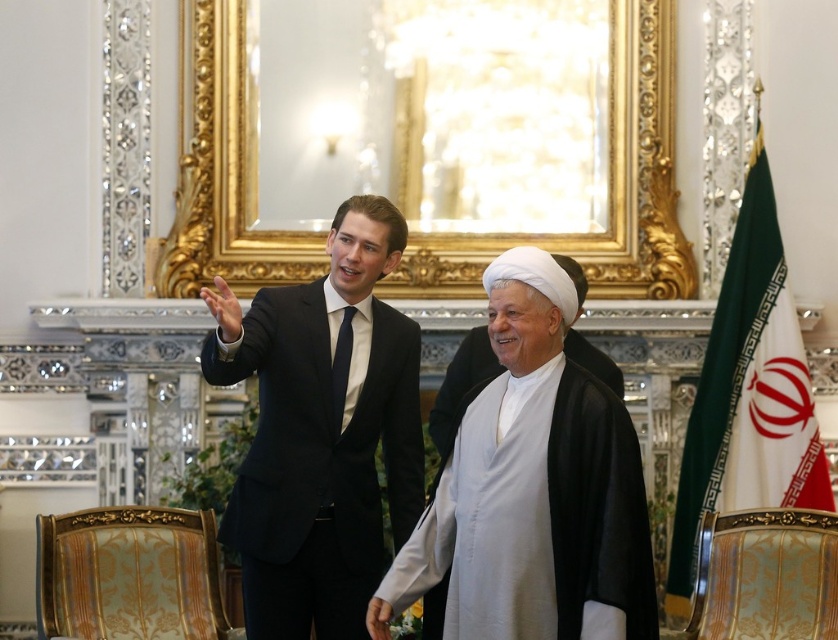
This screenshot has width=838, height=640. Describe the element at coordinates (321, 432) in the screenshot. I see `matte black suit at center` at that location.

Can you confirm if matte black suit at center is positioned below white matte robe at center?

No, matte black suit at center is not below white matte robe at center.

Between point (384, 333) and point (616, 426), which one is positioned in front?

Point (616, 426) is in front.

Locate an element on the screen. This screenshot has height=640, width=838. matte black suit at center is located at coordinates (321, 432).